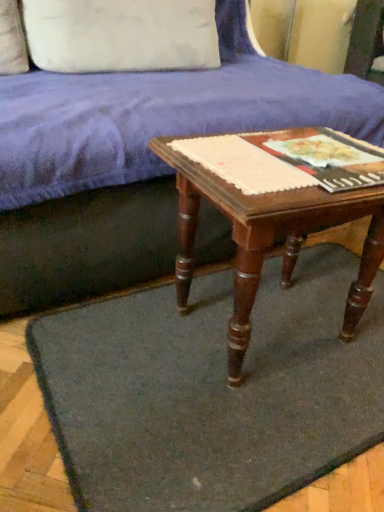
What do you see at coordinates (328, 158) in the screenshot? Image resolution: width=384 pixels, height=512 pixels. I see `matte paper at center, the 2th paperback book positioned from the left` at bounding box center [328, 158].

The image size is (384, 512). I want to click on velvet blue couch at upper center, so click(x=138, y=164).

Identify the location of wooden table at center. The width and height of the screenshot is (384, 512). (276, 209).

I want to click on matte paper at center, positioned as the first paperback book in left-to-right order, so click(x=243, y=164).

Based on the photo, could you tell me if velvet blue couch at upper center is facing dark gray felt mat at center?

Yes, velvet blue couch at upper center faces towards dark gray felt mat at center.

Is velvet blue couch at upper center situated inside dark gray felt mat at center or outside?

velvet blue couch at upper center is not inside dark gray felt mat at center, it's outside.

From a real-world perspective, is velvet blue couch at upper center located higher than dark gray felt mat at center?

Correct, in the physical world, velvet blue couch at upper center is higher than dark gray felt mat at center.

Can you tell me how much matte paper at center, the first paperback book when ordered from right to left, and white cotton pillow at upper left differ in facing direction?

They differ by 0.436 degrees in their facing directions.

Is point (375, 178) closer or farther from the camera than point (209, 5)?

Point (375, 178) appears to be closer to the viewer than point (209, 5).

Is matte paper at center, the first paperback book when ordered from right to left, turned away from white cotton pillow at upper left?

That's not correct — matte paper at center, the first paperback book when ordered from right to left, is not looking away from white cotton pillow at upper left.

Considering the points (171, 96) and (329, 172), which point is in front, point (171, 96) or point (329, 172)?

The point (329, 172) is closer.

Which object is wider, velvet blue couch at upper center or matte paper at center, the first paperback book when ordered from right to left?

velvet blue couch at upper center.

In the scene shown: Is velvet blue couch at upper center not close to matte paper at center, the first paperback book when ordered from right to left?

No, velvet blue couch at upper center is not far from matte paper at center, the first paperback book when ordered from right to left.

Is velvet blue couch at upper center turned away from matte paper at center, the first paperback book when ordered from right to left?

No, velvet blue couch at upper center is not facing the opposite direction of matte paper at center, the first paperback book when ordered from right to left.

Does wooden table at center lie behind dark gray felt mat at center?

Yes.

Considering the relative positions of wooden table at center and dark gray felt mat at center in the image provided, is wooden table at center to the left of dark gray felt mat at center from the viewer's perspective?

No.

Who is bigger, wooden table at center or dark gray felt mat at center?

wooden table at center is bigger.

Is wooden table at center thinner than dark gray felt mat at center?

Indeed, wooden table at center has a lesser width compared to dark gray felt mat at center.

Between velvet blue couch at upper center and white cotton pillow at upper left, which one has more height?

With more height is velvet blue couch at upper center.

Is velvet blue couch at upper center next to white cotton pillow at upper left and touching it?

No, velvet blue couch at upper center is not making contact with white cotton pillow at upper left.

From a real-world perspective, which is physically below, velvet blue couch at upper center or white cotton pillow at upper left?

velvet blue couch at upper center is physically lower.

Is point (258, 230) closer or farther from the camera than point (252, 84)?

Point (258, 230) appears to be closer to the viewer than point (252, 84).

Looking at this image, is wooden table at center not close to velvet blue couch at upper center?

No, wooden table at center is in close proximity to velvet blue couch at upper center.

Considering the relative positions of wooden table at center and velvet blue couch at upper center in the image provided, is wooden table at center to the left of velvet blue couch at upper center from the viewer's perspective?

No, wooden table at center is not to the left of velvet blue couch at upper center.

Is wooden table at center positioned with its back to velvet blue couch at upper center?

Yes, velvet blue couch at upper center is at the back of wooden table at center.

Is matte paper at center, positioned as the first paperback book in left-to-right order, facing towards velvet blue couch at upper center?

No, matte paper at center, positioned as the first paperback book in left-to-right order, is not aimed at velvet blue couch at upper center.

Is matte paper at center, positioned as the first paperback book in left-to-right order, wider than velvet blue couch at upper center?

No, matte paper at center, positioned as the first paperback book in left-to-right order, is not wider than velvet blue couch at upper center.

Looking at this image, is matte paper at center, positioned as the first paperback book in left-to-right order, touching velvet blue couch at upper center?

matte paper at center, positioned as the first paperback book in left-to-right order, and velvet blue couch at upper center are clearly separated.

From a real-world perspective, is matte paper at center, the 2th paperback book viewed from the right, positioned under velvet blue couch at upper center based on gravity?

Incorrect, from a real-world perspective, matte paper at center, the 2th paperback book viewed from the right, is higher than velvet blue couch at upper center.

Identify the location of mat that is in front of the velvet blue couch at upper center. (212, 391).

Which paperback book is the 2nd one when counting from the right side of the white cotton pillow at upper left? Please provide its 2D coordinates.

[(328, 158)]

Considering their positions, is velvet blue couch at upper center positioned closer to white cotton pillow at upper left than dark gray felt mat at center?

Based on the image, velvet blue couch at upper center appears to be nearer to white cotton pillow at upper left.

Looking at the image, which one is located further to wooden table at center, velvet blue couch at upper center or matte paper at center, the 2th paperback book viewed from the right?

velvet blue couch at upper center lies further to wooden table at center than the other object.

Which object lies further to the anchor point dark gray felt mat at center, matte paper at center, the 2th paperback book viewed from the right, or white cotton pillow at upper left?

The object further to dark gray felt mat at center is white cotton pillow at upper left.

In the scene shown: Looking at the image, which one is located further to matte paper at center, the 2th paperback book viewed from the right, wooden table at center or white cotton pillow at upper left?

The object further to matte paper at center, the 2th paperback book viewed from the right, is white cotton pillow at upper left.

Considering their positions, is dark gray felt mat at center positioned closer to wooden table at center than white cotton pillow at upper left?

Among the two, dark gray felt mat at center is located nearer to wooden table at center.

Which object lies nearer to the anchor point wooden table at center, matte paper at center, positioned as the first paperback book in left-to-right order, or white cotton pillow at upper left?

matte paper at center, positioned as the first paperback book in left-to-right order, lies closer to wooden table at center than the other object.

Estimate the real-world distances between objects in this image. Which object is further from wooden table at center, matte paper at center, the 2th paperback book viewed from the right, or velvet blue couch at upper center?

Among the two, velvet blue couch at upper center is located further to wooden table at center.

Based on their spatial positions, is dark gray felt mat at center or matte paper at center, the 2th paperback book viewed from the right, closer to white cotton pillow at upper left?

Among the two, matte paper at center, the 2th paperback book viewed from the right, is located nearer to white cotton pillow at upper left.

Find the location of a particular element. This screenshot has height=512, width=384. studio couch between white cotton pillow at upper left and dark gray felt mat at center in the vertical direction is located at coordinates point(138,164).

Locate an element on the screen. The height and width of the screenshot is (512, 384). table between matte paper at center, the first paperback book when ordered from right to left, and dark gray felt mat at center vertically is located at coordinates (x=276, y=209).

Image resolution: width=384 pixels, height=512 pixels. Identify the location of table between velvet blue couch at upper center and dark gray felt mat at center vertically. (276, 209).

Identify the location of studio couch between white cotton pillow at upper left and wooden table at center from top to bottom. (138, 164).